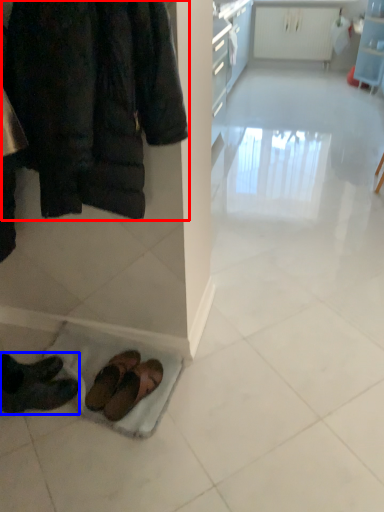
Question: Which of the following is the farthest to the observer, jacket (highlighted by a red box) or footwear (highlighted by a blue box)?

Choices:
 (A) jacket
 (B) footwear

Answer: (B)